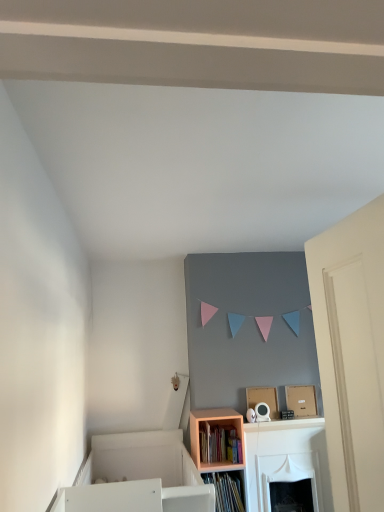
Question: Is wooden bookshelf at lower center bigger than peach wood shelf at lower center?

Choices:
 (A) no
 (B) yes

Answer: (A)

Question: Is wooden bookshelf at lower center directly adjacent to peach wood shelf at lower center?

Choices:
 (A) yes
 (B) no

Answer: (A)

Question: Is wooden bookshelf at lower center thinner than peach wood shelf at lower center?

Choices:
 (A) yes
 (B) no

Answer: (A)

Question: From a real-world perspective, does wooden bookshelf at lower center sit lower than peach wood shelf at lower center?

Choices:
 (A) yes
 (B) no

Answer: (B)

Question: Is wooden bookshelf at lower center smaller than peach wood shelf at lower center?

Choices:
 (A) yes
 (B) no

Answer: (A)

Question: From the image's perspective, would you say wooden bookshelf at lower center is shown under peach wood shelf at lower center?

Choices:
 (A) yes
 (B) no

Answer: (B)

Question: Is peach wood shelf at lower center to the left of wooden bookshelf at lower center from the viewer's perspective?

Choices:
 (A) no
 (B) yes

Answer: (A)

Question: Would you say peach wood shelf at lower center contains wooden bookshelf at lower center?

Choices:
 (A) no
 (B) yes

Answer: (B)

Question: Considering the relative sizes of peach wood shelf at lower center and wooden bookshelf at lower center in the image provided, is peach wood shelf at lower center wider than wooden bookshelf at lower center?

Choices:
 (A) no
 (B) yes

Answer: (B)

Question: Does peach wood shelf at lower center lie behind wooden bookshelf at lower center?

Choices:
 (A) yes
 (B) no

Answer: (B)

Question: Is peach wood shelf at lower center not near wooden bookshelf at lower center?

Choices:
 (A) no
 (B) yes

Answer: (A)

Question: Is peach wood shelf at lower center touching wooden bookshelf at lower center?

Choices:
 (A) no
 (B) yes

Answer: (B)

Question: From the image's perspective, is peach wood shelf at lower center above or below wooden bookshelf at lower center?

Choices:
 (A) below
 (B) above

Answer: (A)